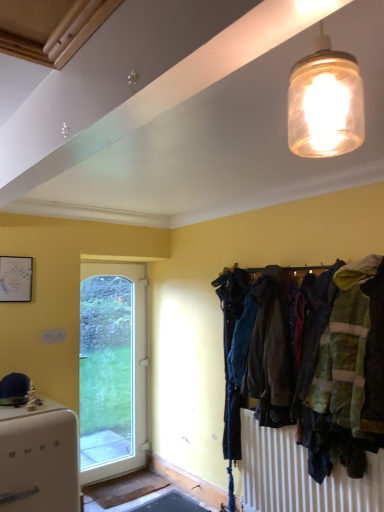
Question: From a real-world perspective, is translucent glass jar at upper center under white glossy door at left?

Choices:
 (A) yes
 (B) no

Answer: (B)

Question: Is translucent glass jar at upper center touching white glossy door at left?

Choices:
 (A) no
 (B) yes

Answer: (A)

Question: Is translucent glass jar at upper center at the left side of white glossy door at left?

Choices:
 (A) no
 (B) yes

Answer: (A)

Question: Can you confirm if translucent glass jar at upper center is positioned to the right of white glossy door at left?

Choices:
 (A) no
 (B) yes

Answer: (B)

Question: Can you confirm if translucent glass jar at upper center is smaller than white glossy door at left?

Choices:
 (A) no
 (B) yes

Answer: (B)

Question: Can you confirm if translucent glass jar at upper center is wider than white glossy door at left?

Choices:
 (A) yes
 (B) no

Answer: (B)

Question: Does translucent glass jar at upper center have a greater width compared to white matte refrigerator at lower left?

Choices:
 (A) yes
 (B) no

Answer: (B)

Question: Can you confirm if translucent glass jar at upper center is taller than white matte refrigerator at lower left?

Choices:
 (A) no
 (B) yes

Answer: (A)

Question: Does translucent glass jar at upper center appear on the right side of white matte refrigerator at lower left?

Choices:
 (A) no
 (B) yes

Answer: (B)

Question: Is translucent glass jar at upper center to the left of white matte refrigerator at lower left from the viewer's perspective?

Choices:
 (A) yes
 (B) no

Answer: (B)

Question: From a real-world perspective, is translucent glass jar at upper center located higher than white matte refrigerator at lower left?

Choices:
 (A) no
 (B) yes

Answer: (B)

Question: Is white matte refrigerator at lower left completely or partially inside translucent glass jar at upper center?

Choices:
 (A) yes
 (B) no

Answer: (B)

Question: From a real-world perspective, is dark blue fabric coat at center right under white matte refrigerator at lower left?

Choices:
 (A) no
 (B) yes

Answer: (A)